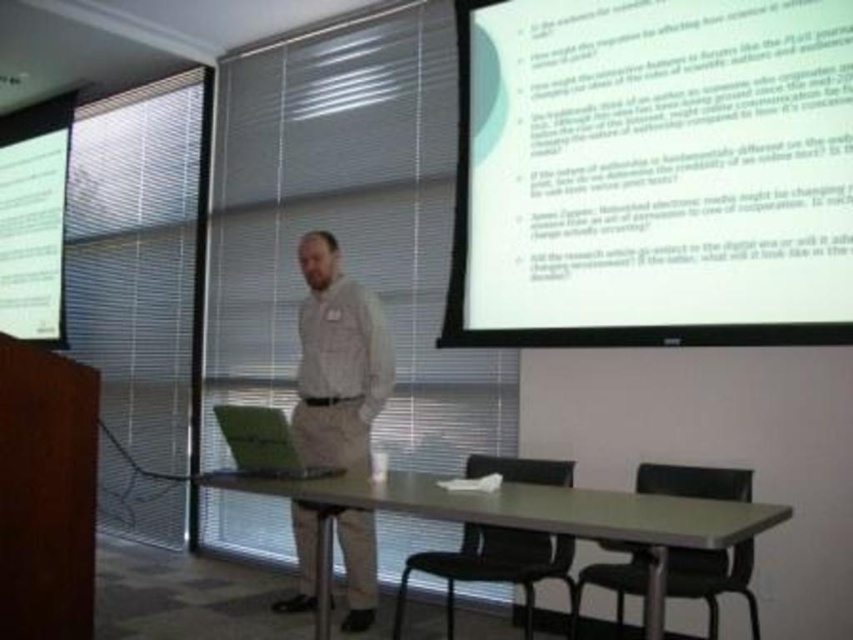
Can you confirm if white glossy projector screen at upper right is positioned below metallic gray table at center?

Incorrect, white glossy projector screen at upper right is not positioned below metallic gray table at center.

Is white glossy projector screen at upper right wider than metallic gray table at center?

No, white glossy projector screen at upper right is not wider than metallic gray table at center.

Locate an element on the screen. This screenshot has height=640, width=853. white glossy projector screen at upper right is located at coordinates (653, 173).

Does metallic gray table at center have a greater width compared to green matte laptop at center?

Correct, the width of metallic gray table at center exceeds that of green matte laptop at center.

Between point (660, 612) and point (267, 465), which one is positioned in front?

Point (660, 612) is in front.

Find the location of a particular element. This screenshot has width=853, height=640. metallic gray table at center is located at coordinates pos(521,516).

Who is more forward, (345, 280) or (225, 442)?

Point (345, 280) is in front.

The image size is (853, 640). What are the coordinates of `light beige shirt at center` in the screenshot? It's located at (337, 360).